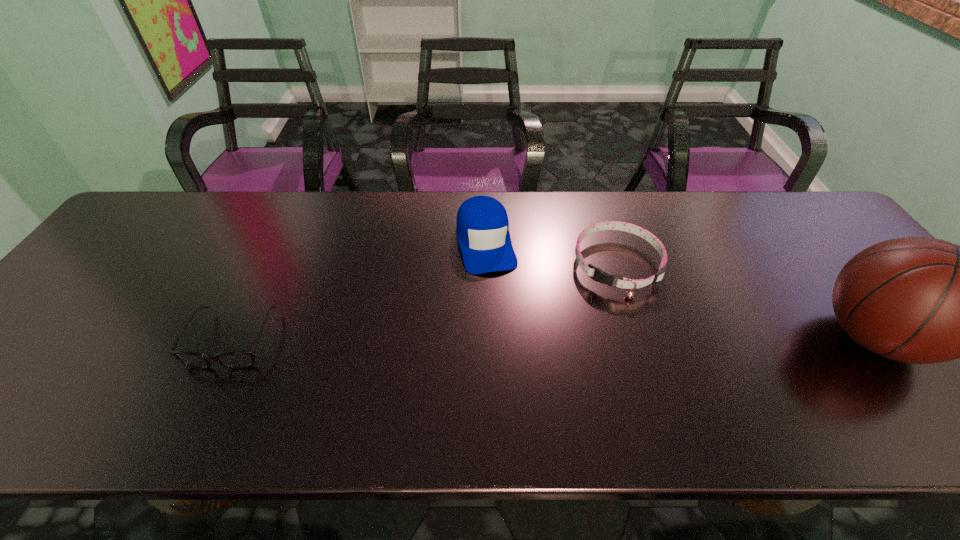
The image size is (960, 540). I want to click on vacant space on the desktop that is between the leftmost object and the rightmost object and is positioned with the buckle on the dog collar, so click(576, 339).

This screenshot has width=960, height=540. What are the coordinates of `free space on the desktop that is between the leftmost object and the tallest object and is positioned on the front-facing side of the third object from right to left` in the screenshot? It's located at (513, 339).